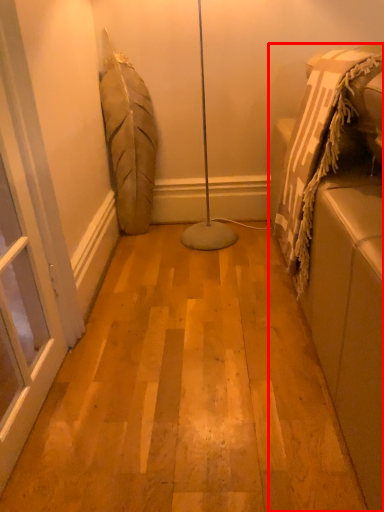
Question: From the image's perspective, where is furniture (annotated by the red box) located relative to screen door?

Choices:
 (A) below
 (B) above

Answer: (B)